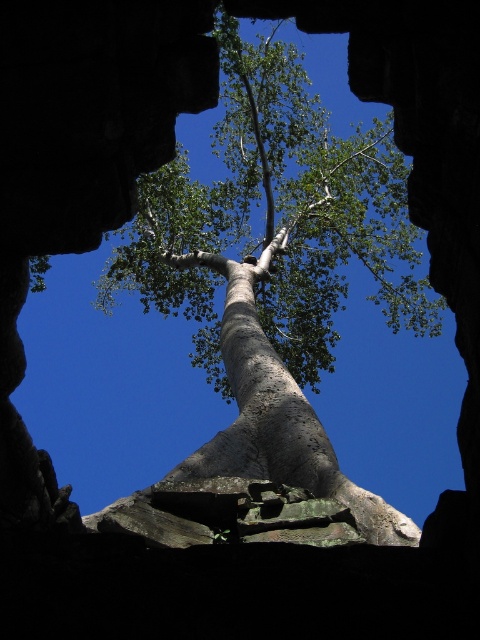
Question: Does smooth bark tree at center have a larger size compared to smooth gray tree trunk at center?

Choices:
 (A) yes
 (B) no

Answer: (A)

Question: Does smooth bark tree at center appear on the left side of smooth gray tree trunk at center?

Choices:
 (A) yes
 (B) no

Answer: (B)

Question: Is smooth bark tree at center wider than smooth gray tree trunk at center?

Choices:
 (A) yes
 (B) no

Answer: (A)

Question: Which point is closer to the camera taking this photo?

Choices:
 (A) (247, 432)
 (B) (298, 476)

Answer: (B)